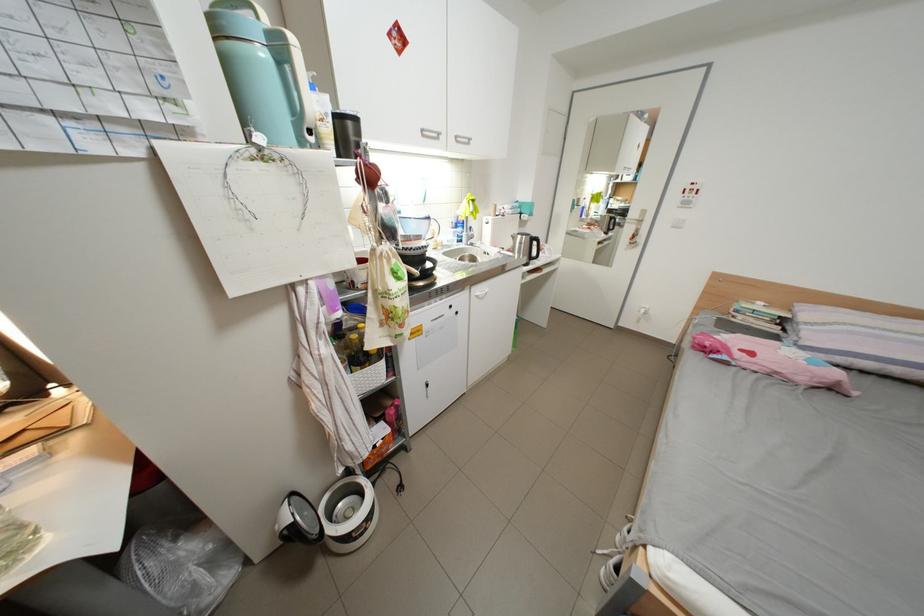
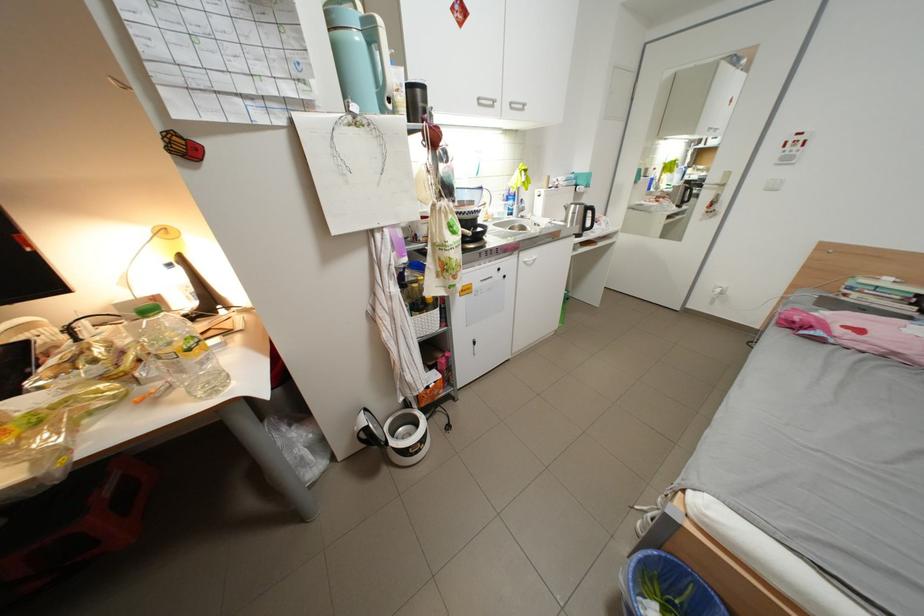
The point at (468, 240) is marked in the first image. Where is the corresponding point in the second image?

(517, 213)